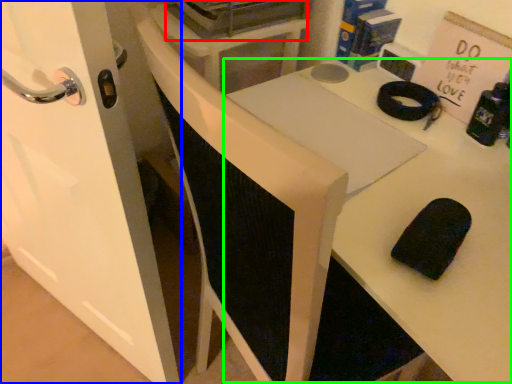
Question: Which is nearer to the appliance (highlighted by a red box)? door (highlighted by a blue box) or table (highlighted by a green box).

Choices:
 (A) door
 (B) table

Answer: (B)